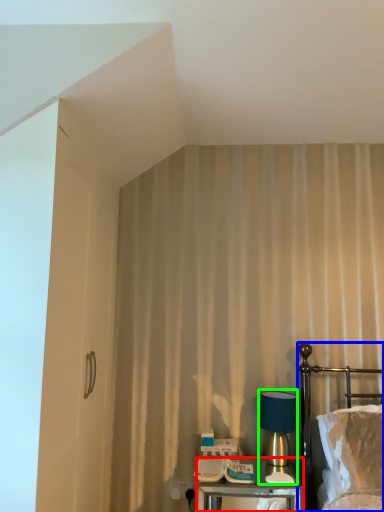
Question: Considering the real-world distances, which object is farthest from nightstand (highlighted by a red box)? bed (highlighted by a blue box) or table lamp (highlighted by a green box)?

Choices:
 (A) bed
 (B) table lamp

Answer: (A)